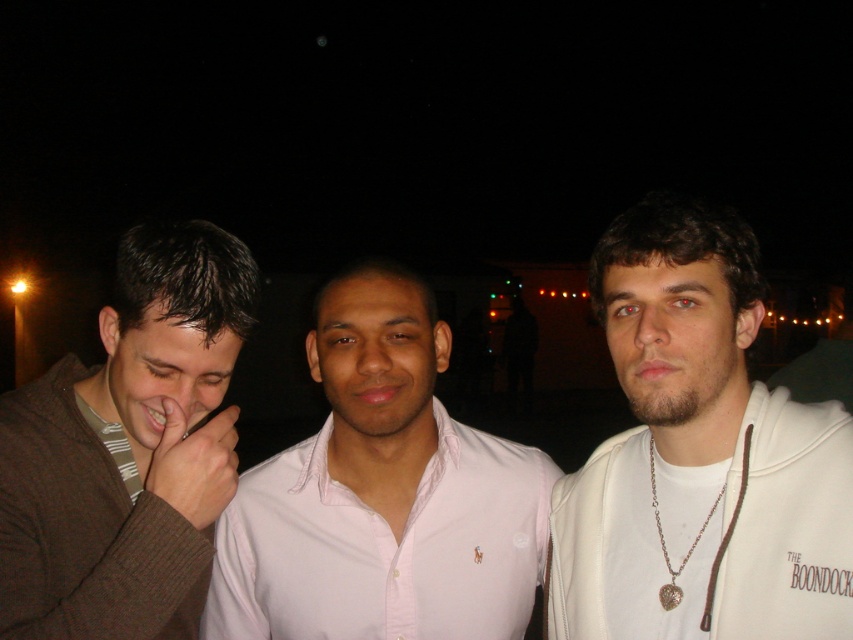
Question: Can you confirm if brown wool sweater at left is thinner than matte brown hand at center?

Choices:
 (A) no
 (B) yes

Answer: (A)

Question: Among these objects, which one is nearest to the camera?

Choices:
 (A) brown wool sweater at left
 (B) matte brown hand at center
 (C) pink cotton shirt at center
 (D) white matte hoodie at center

Answer: (D)

Question: Estimate the real-world distances between objects in this image. Which object is closer to the pink cotton shirt at center?

Choices:
 (A) matte brown hand at center
 (B) white matte hoodie at center
 (C) brown wool sweater at left

Answer: (A)

Question: Is pink cotton shirt at center to the right of matte brown hand at center from the viewer's perspective?

Choices:
 (A) no
 (B) yes

Answer: (B)

Question: Is brown wool sweater at left thinner than matte brown hand at center?

Choices:
 (A) yes
 (B) no

Answer: (B)

Question: Which point is closer to the camera?

Choices:
 (A) brown wool sweater at left
 (B) pink cotton shirt at center
 (C) matte brown hand at center
 (D) white matte hoodie at center

Answer: (D)